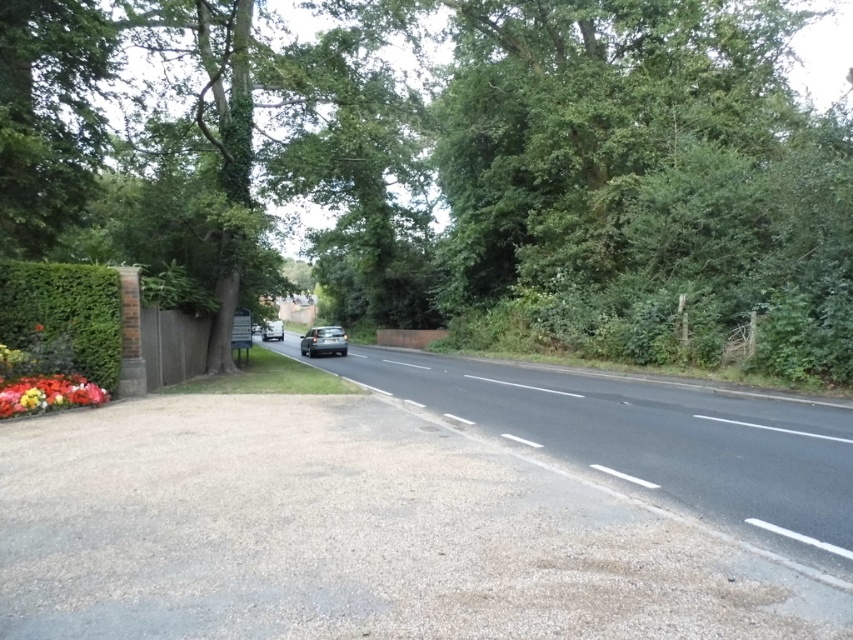
You are standing at the scene and want to cross the black asphalt road at center. If your walking speed is 1.5 meters per second, how many seconds will it take you to reach the road?

The distance between you and the black asphalt road at center is 3.14 meters. At a walking speed of 1.5 meters per second, it would take approximately 2.09 seconds to reach the road.

You are standing at the intersection of the gravel driveway and the paved road. You need to find the green leafy tree at center. In which direction should you look relative to the paved road?

The green leafy tree at center is located at point coordinates, so you should look towards the center of the image where the coordinates are located relative to the paved road.

You are standing on the gravel driveway and want to walk to the black asphalt road at center. Which direction should you move relative to the green leafy hedge at left?

The black asphalt road at center is located below the green leafy hedge at left. To reach it, you should move downward from the hedge.